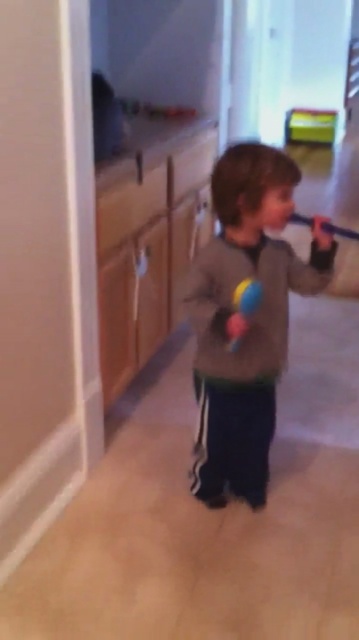
You are a delivery robot in a house. You need to move from your current position to a point marked as point (x=286, y=198). The hallway has a width of 5 feet. Can you safely navigate to that point without hitting the walls?

The distance between point (x=286, y=198) and the camera is 5.49 feet. Since the hallway is 5 feet wide, the robot must ensure it stays within the 5 feet width. However, the robot needs to move along the hallway, and if the path to the point is straight and the robot can maneuver within the hallway width, it might be possible. But the distance given is from the camera to the point, not the width. The question mentions the hallway width is 5 feet, so if the robot is 5.49 feet away from the point, but the path

You are a parent trying to locate your child who is playing hide and seek in the house. You see the gray fleece sweater at center and the rubber ball at center in the hallway. Which object is closer to the floor?

The gray fleece sweater at center is positioned under the rubber ball at center, so the gray fleece sweater at center is closer to the floor.